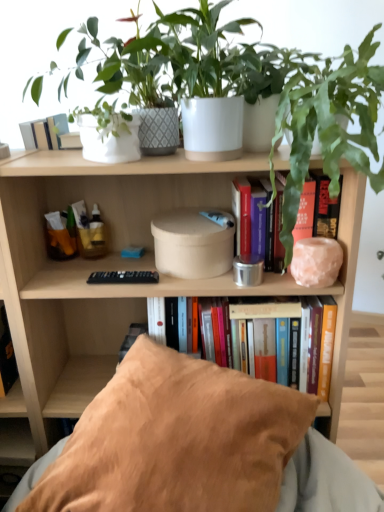
You are a GUI agent. You are given a task and a screenshot of the screen. Output one action in this format:
    pyautogui.click(x=<x>, y=<y>)
    Task: Click on the vacant point above matte cardboard box at center (from a real-world perspective)
    The image size is (384, 512).
    Given the screenshot: What is the action you would take?
    [102, 159]